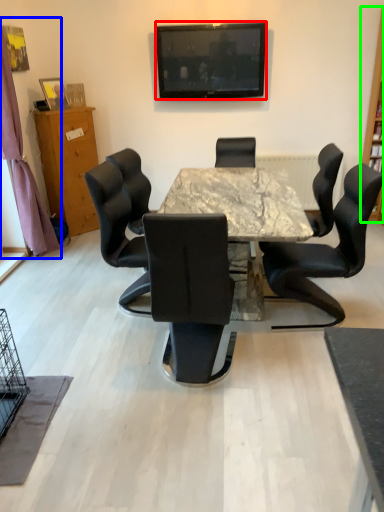
Question: Which is nearer to the television (highlighted by a red box)? curtain (highlighted by a blue box) or bookshelf (highlighted by a green box).

Choices:
 (A) curtain
 (B) bookshelf

Answer: (B)